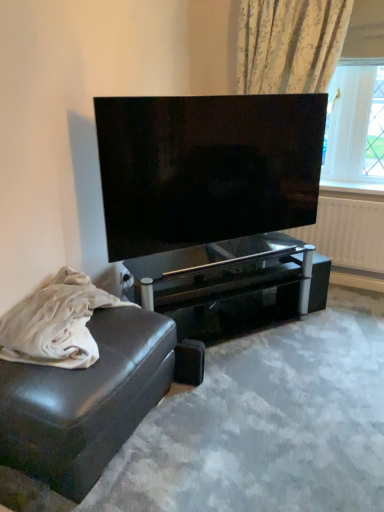
Question: From a real-world perspective, does white glossy radiator at upper right sit lower than leather couch at lower left?

Choices:
 (A) no
 (B) yes

Answer: (A)

Question: Could leather couch at lower left be considered to be inside white glossy radiator at upper right?

Choices:
 (A) no
 (B) yes

Answer: (A)

Question: Are white glossy radiator at upper right and leather couch at lower left located far from each other?

Choices:
 (A) yes
 (B) no

Answer: (A)

Question: Is white glossy radiator at upper right next to leather couch at lower left?

Choices:
 (A) yes
 (B) no

Answer: (B)

Question: Can we say white glossy radiator at upper right lies outside leather couch at lower left?

Choices:
 (A) yes
 (B) no

Answer: (A)

Question: From the image's perspective, is white glossy radiator at upper right beneath leather couch at lower left?

Choices:
 (A) yes
 (B) no

Answer: (B)

Question: Is leather couch at lower left aimed at matte black tv at center?

Choices:
 (A) no
 (B) yes

Answer: (A)

Question: Would you say leather couch at lower left is a long distance from matte black tv at center?

Choices:
 (A) yes
 (B) no

Answer: (B)

Question: Considering the relative sizes of leather couch at lower left and matte black tv at center in the image provided, is leather couch at lower left wider than matte black tv at center?

Choices:
 (A) no
 (B) yes

Answer: (B)

Question: Is leather couch at lower left looking in the opposite direction of matte black tv at center?

Choices:
 (A) yes
 (B) no

Answer: (B)

Question: Is leather couch at lower left shorter than matte black tv at center?

Choices:
 (A) yes
 (B) no

Answer: (A)

Question: From the image's perspective, is leather couch at lower left on matte black tv at center?

Choices:
 (A) no
 (B) yes

Answer: (A)

Question: Does black glass table at center have a lesser width compared to leather couch at lower left?

Choices:
 (A) yes
 (B) no

Answer: (A)